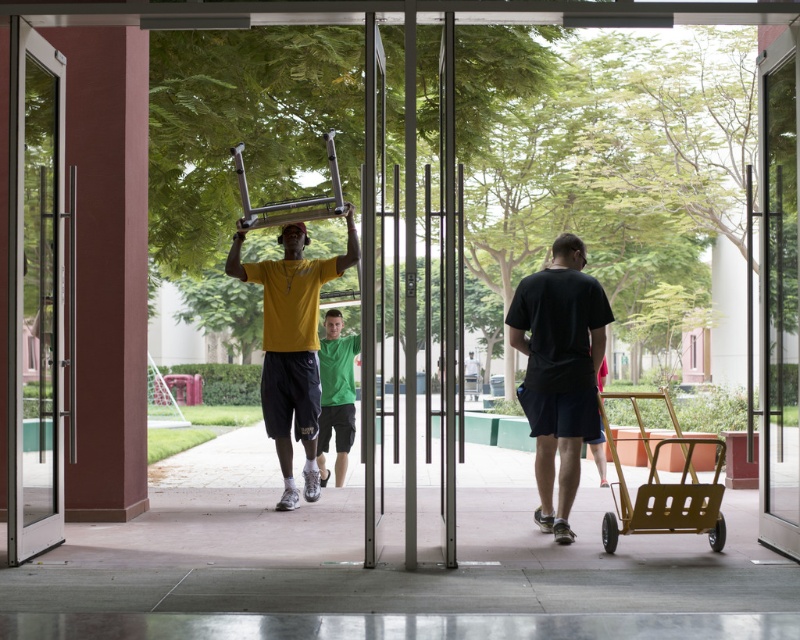
Question: Estimate the real-world distances between objects in this image. Which object is closer to the green matte head at center?

Choices:
 (A) transparent glass door at center
 (B) transparent glass screen door at center
 (C) black matte t-shirt at center
 (D) matte yellow head at center

Answer: (D)

Question: Which point is farther from the camera taking this photo?

Choices:
 (A) (x=336, y=372)
 (B) (x=578, y=248)
 (C) (x=544, y=525)

Answer: (A)

Question: Does transparent glass screen door at center appear over smooth brown hair at upper center?

Choices:
 (A) no
 (B) yes

Answer: (A)

Question: Is the position of transparent glass screen door at left less distant than that of matte yellow head at center?

Choices:
 (A) no
 (B) yes

Answer: (B)

Question: Estimate the real-world distances between objects in this image. Which object is closer to the smooth brown hair at upper center?

Choices:
 (A) matte yellow head at center
 (B) green matte head at center
 (C) black matte t-shirt at center

Answer: (C)

Question: Does transparent glass screen door at center have a smaller size compared to yellow matte t-shirt at center?

Choices:
 (A) no
 (B) yes

Answer: (B)